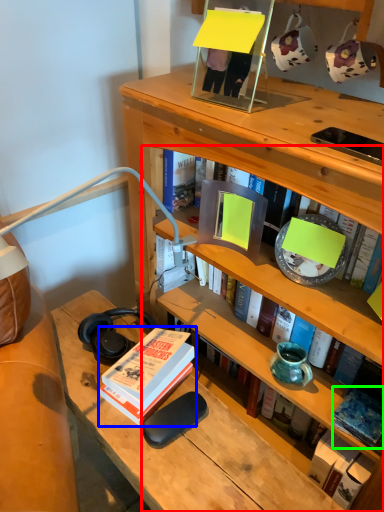
Question: Which object is positioned farthest from book (highlighted by a red box)? Select from book (highlighted by a blue box) and book (highlighted by a green box).

Choices:
 (A) book
 (B) book

Answer: (B)